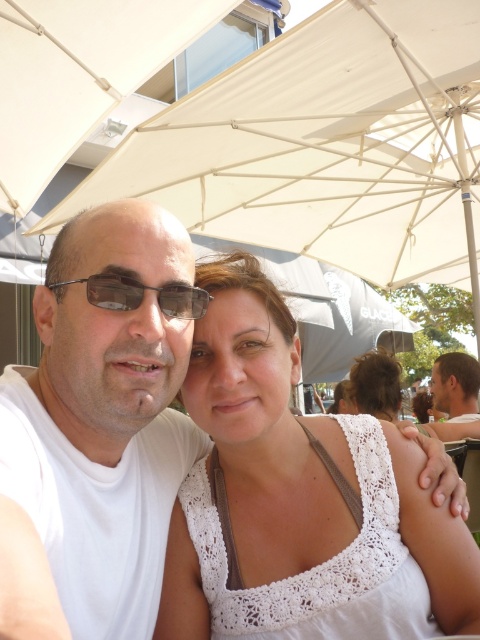
You are a photographer trying to capture the perfect shot of the matte black sunglasses at center. The camera has a focus point at coordinates 0.463, 0.294. Will the sunglasses be in focus?

The matte black sunglasses at center is positioned exactly at point [141,296], so the camera focus point is perfectly aligned with the sunglasses, ensuring they will be in focus.

You are a photographer trying to capture a clear shot of the smooth brown hair at upper right without the white fabric umbrella at upper center blocking it. What adjustment should you make to your camera position?

To avoid the white fabric umbrella at upper center blocking the smooth brown hair at upper right, you should move your camera position backward to create more distance between the umbrella and the hair.